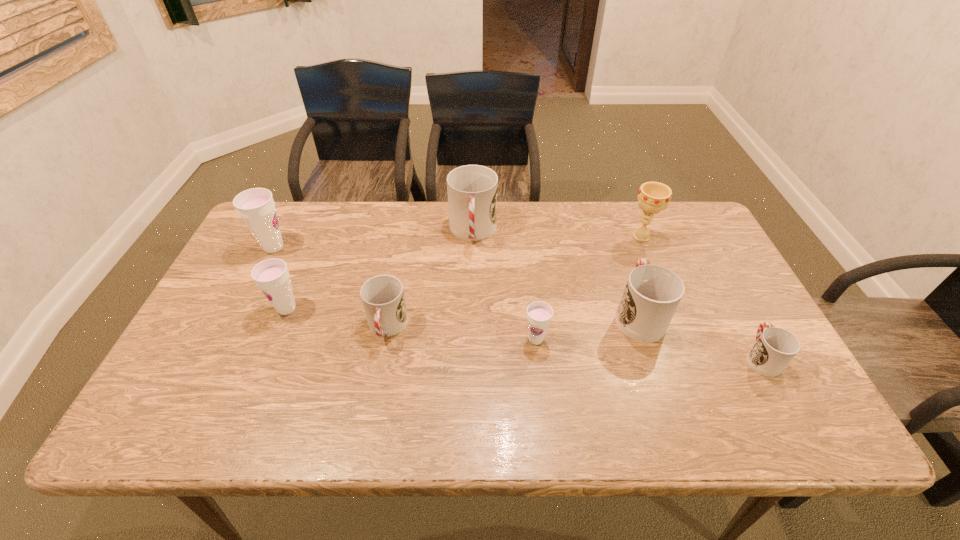
Find the location of a particular element. This screenshot has height=540, width=960. the second smallest red cup is located at coordinates (382, 296).

I want to click on the smallest purple cup, so click(x=539, y=314).

You are a GUI agent. You are given a task and a screenshot of the screen. Output one action in this format:
    pyautogui.click(x=<x>, y=<y>)
    Task: Click on the fourth object from right to left
    This screenshot has width=960, height=540.
    Given the screenshot: What is the action you would take?
    pyautogui.click(x=539, y=314)

Image resolution: width=960 pixels, height=540 pixels. I want to click on the shortest object, so click(775, 347).

Where is `the smallest red cup`? Image resolution: width=960 pixels, height=540 pixels. the smallest red cup is located at coordinates (775, 347).

At what (x,y) coordinates should I click in order to perform the action: click on vacant space situated on the right of the leftmost cup. Please return your answer as a coordinate pair (x, y). Looking at the image, I should click on (419, 247).

This screenshot has height=540, width=960. I want to click on vacant space located 0.280m on the side of the third red cup from right to left where the handle is located, so click(471, 329).

Locate an element on the screen. vacant region located on the front of the chalice is located at coordinates (681, 335).

Identify the location of vacant region located on the side of the second red cup from right to left where the handle is located. The height and width of the screenshot is (540, 960). (607, 220).

The width and height of the screenshot is (960, 540). Identify the location of vacant area situated 0.310m on the side of the second red cup from right to left where the handle is located. (607, 220).